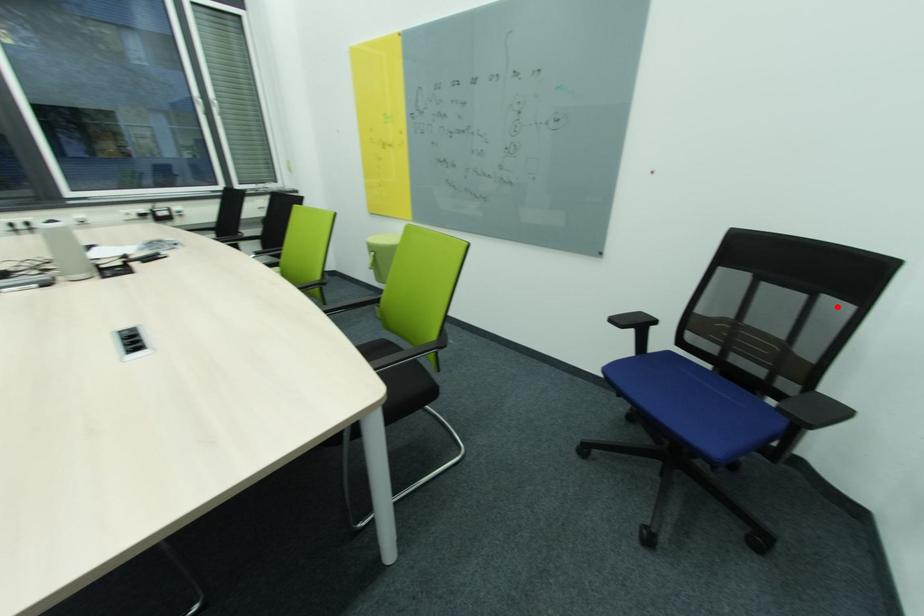
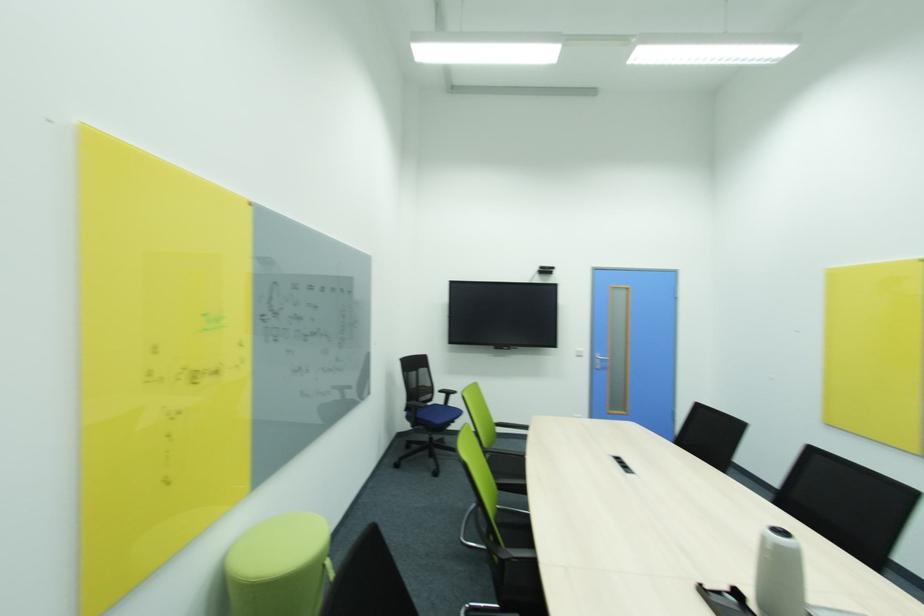
Where in the second image is the point corresponding to the highlighted location from the first image?

(428, 371)